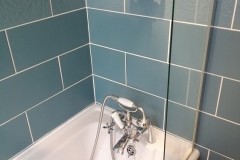
Where is `right tile wall`? The height and width of the screenshot is (160, 240). right tile wall is located at coordinates (185, 44).